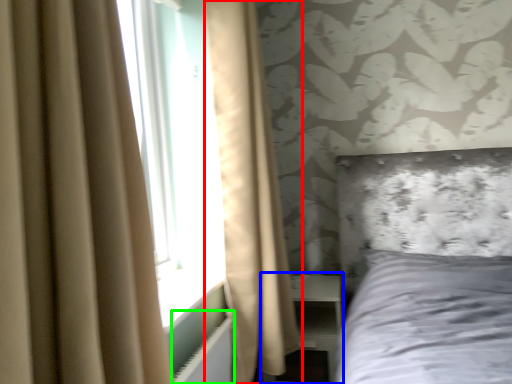
Question: Considering the real-world distances, which object is farthest from curtain (highlighted by a red box)? dresser (highlighted by a blue box) or radiator (highlighted by a green box)?

Choices:
 (A) dresser
 (B) radiator

Answer: (B)